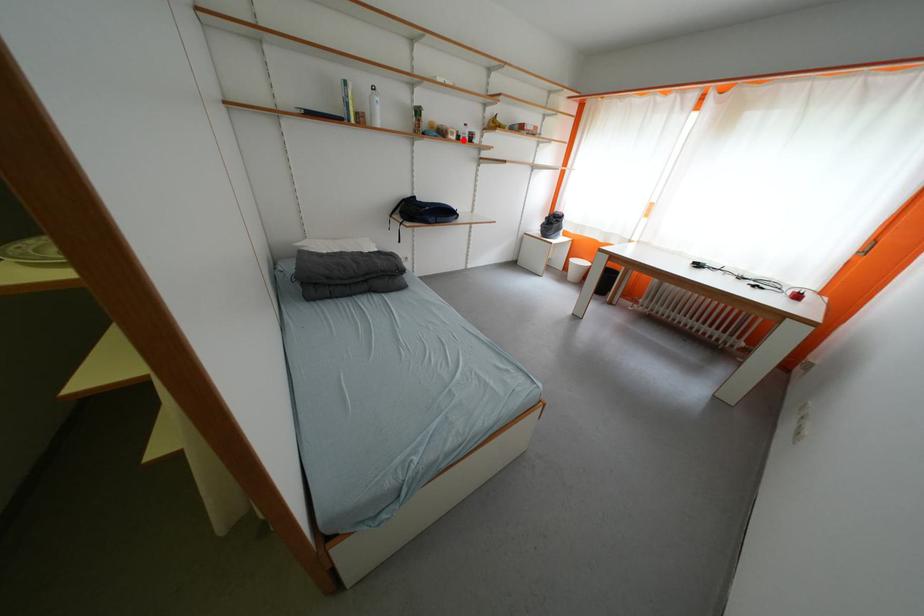
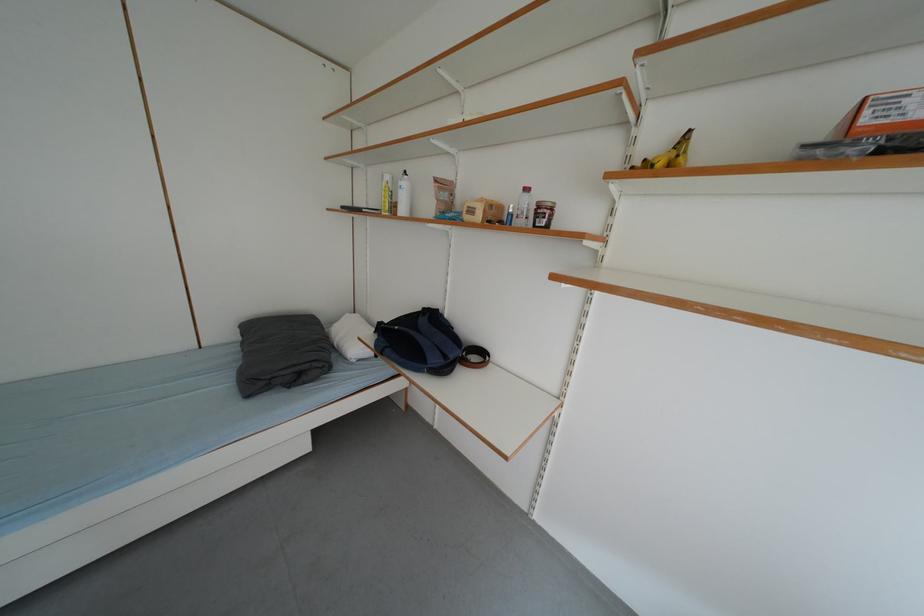
Question: I am providing you with two images of the same scene from different viewpoints. Given a red point in image1, look at the same physical point in image2. Is it:

Choices:
 (A) Closer to the viewpoint
 (B) Farther from the viewpoint

Answer: (B)